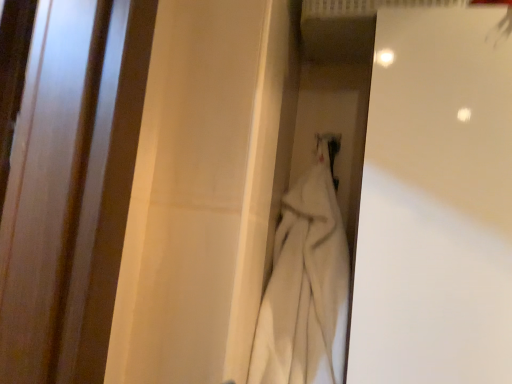
You are a GUI agent. You are given a task and a screenshot of the screen. Output one action in this format:
    pyautogui.click(x=<x>, y=<y>)
    Task: Click on the white glossy door at upper right
    The width and height of the screenshot is (512, 384).
    Given the screenshot: What is the action you would take?
    pyautogui.click(x=436, y=202)

What do you see at coordinates (436, 202) in the screenshot? I see `white glossy door at upper right` at bounding box center [436, 202].

Find the location of a particular element. The image size is (512, 384). white glossy door at upper right is located at coordinates (436, 202).